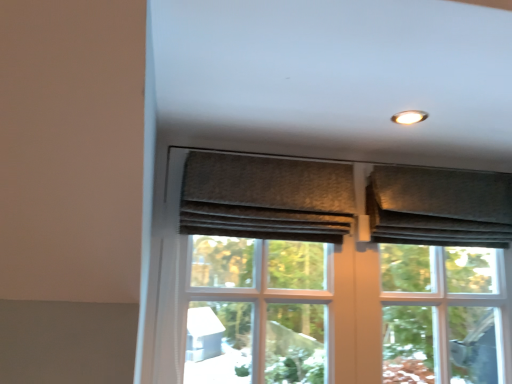
This screenshot has height=384, width=512. Describe the element at coordinates (439, 207) in the screenshot. I see `textured gray curtain at upper right, the 1th curtain when ordered from right to left` at that location.

This screenshot has height=384, width=512. Describe the element at coordinates (446, 314) in the screenshot. I see `textured gray fabric at upper right` at that location.

This screenshot has height=384, width=512. What do you see at coordinates (266, 198) in the screenshot? I see `textured gray curtain at upper center, which is the 1th curtain in left-to-right order` at bounding box center [266, 198].

This screenshot has width=512, height=384. Identify the location of textured gray curtain at upper right, the 2th curtain viewed from the left. (439, 207).

Considering the sizes of objects matte brown screen door at center and textured gray curtain at upper center, which ranks as the second curtain in right-to-left order, in the image provided, who is taller, matte brown screen door at center or textured gray curtain at upper center, which ranks as the second curtain in right-to-left order,?

matte brown screen door at center is taller.

From the image's perspective, is matte brown screen door at center above textured gray curtain at upper center, which ranks as the second curtain in right-to-left order?

No, from the image's perspective, matte brown screen door at center is not on top of textured gray curtain at upper center, which ranks as the second curtain in right-to-left order.

Would you say matte brown screen door at center is a long distance from textured gray curtain at upper center, which is the 1th curtain in left-to-right order?

Result: matte brown screen door at center is actually quite close to textured gray curtain at upper center, which is the 1th curtain in left-to-right order.

From a real-world perspective, which object rests below the other?

In real-world perspective, textured gray fabric at upper right is lower.

Which is closer to the camera, (480, 269) or (253, 175)?

Point (480, 269) is positioned farther from the camera compared to point (253, 175).

From the image's perspective, between textured gray fabric at upper right and textured gray curtain at upper center, which ranks as the second curtain in right-to-left order, who is located below?

textured gray fabric at upper right appears lower in the image.

Is textured gray fabric at upper right facing towards textured gray curtain at upper center, which ranks as the second curtain in right-to-left order?

No, textured gray fabric at upper right does not turn towards textured gray curtain at upper center, which ranks as the second curtain in right-to-left order.

Does textured gray fabric at upper right have a greater width compared to matte brown screen door at center?

Indeed, textured gray fabric at upper right has a greater width compared to matte brown screen door at center.

Image resolution: width=512 pixels, height=384 pixels. I want to click on bay window behind the matte brown screen door at center, so click(446, 314).

Considering the sizes of textured gray fabric at upper right and matte brown screen door at center in the image, is textured gray fabric at upper right bigger or smaller than matte brown screen door at center?

textured gray fabric at upper right is bigger than matte brown screen door at center.

Considering the points (250, 335) and (424, 310), which point is in front, point (250, 335) or point (424, 310)?

Point (424, 310)

In order to click on screen door below the textured gray fabric at upper right (from the image's perspective) in this screenshot , I will do `click(256, 311)`.

Looking at this image, from a real-world perspective, which is physically above, matte brown screen door at center or textured gray fabric at upper right?

textured gray fabric at upper right is physically above.

In terms of size, does matte brown screen door at center appear bigger or smaller than textured gray fabric at upper right?

In the image, matte brown screen door at center appears to be smaller than textured gray fabric at upper right.

Looking at this image, from the image's perspective, is textured gray curtain at upper center, which ranks as the second curtain in right-to-left order, on top of matte brown screen door at center?

Yes, from the image's perspective, textured gray curtain at upper center, which ranks as the second curtain in right-to-left order, is on top of matte brown screen door at center.

From the matte brown screen door at center, count 1st curtain to the right and point to it. Please provide its 2D coordinates.

[(266, 198)]

Is textured gray curtain at upper center, which ranks as the second curtain in right-to-left order, to the left or to the right of matte brown screen door at center in the image?

textured gray curtain at upper center, which ranks as the second curtain in right-to-left order, is to the right of matte brown screen door at center.

Which point is more forward, (295, 218) or (203, 261)?

The point (295, 218) is closer.

How distant is textured gray curtain at upper center, which is the 1th curtain in left-to-right order, from textured gray curtain at upper right, the 1th curtain when ordered from right to left?

textured gray curtain at upper center, which is the 1th curtain in left-to-right order, and textured gray curtain at upper right, the 1th curtain when ordered from right to left, are 12.53 inches apart.

Which object is positioned more to the left, textured gray curtain at upper center, which ranks as the second curtain in right-to-left order, or textured gray curtain at upper right, the 1th curtain when ordered from right to left?

Positioned to the left is textured gray curtain at upper center, which ranks as the second curtain in right-to-left order.

Which of these two, textured gray curtain at upper center, which ranks as the second curtain in right-to-left order, or textured gray curtain at upper right, the 2th curtain viewed from the left, is bigger?

textured gray curtain at upper right, the 2th curtain viewed from the left.

Is textured gray curtain at upper center, which is the 1th curtain in left-to-right order, turned away from textured gray curtain at upper right, the 1th curtain when ordered from right to left?

No, textured gray curtain at upper center, which is the 1th curtain in left-to-right order, is not facing away from textured gray curtain at upper right, the 1th curtain when ordered from right to left.

Is textured gray fabric at upper right wider than textured gray curtain at upper right, the 1th curtain when ordered from right to left?

In fact, textured gray fabric at upper right might be narrower than textured gray curtain at upper right, the 1th curtain when ordered from right to left.

Is point (408, 300) positioned after point (489, 184)?

No, it is in front of (489, 184).

From a real-world perspective, relative to textured gray curtain at upper right, the 2th curtain viewed from the left, is textured gray fabric at upper right vertically above or below?

textured gray fabric at upper right is below textured gray curtain at upper right, the 2th curtain viewed from the left.

Locate an element on the screen. The height and width of the screenshot is (384, 512). screen door behind the textured gray curtain at upper center, which is the 1th curtain in left-to-right order is located at coordinates (256, 311).

Locate an element on the screen. the 1st curtain above the textured gray fabric at upper right (from a real-world perspective) is located at coordinates (266, 198).

When comparing their distances from matte brown screen door at center, does textured gray curtain at upper right, the 1th curtain when ordered from right to left, or textured gray curtain at upper center, which ranks as the second curtain in right-to-left order, seem closer?

The object closer to matte brown screen door at center is textured gray curtain at upper center, which ranks as the second curtain in right-to-left order.

Based on their spatial positions, is textured gray curtain at upper center, which ranks as the second curtain in right-to-left order, or textured gray fabric at upper right closer to matte brown screen door at center?

Based on the image, textured gray curtain at upper center, which ranks as the second curtain in right-to-left order, appears to be nearer to matte brown screen door at center.

Based on their spatial positions, is textured gray curtain at upper right, the 1th curtain when ordered from right to left, or matte brown screen door at center closer to textured gray curtain at upper center, which ranks as the second curtain in right-to-left order?

matte brown screen door at center lies closer to textured gray curtain at upper center, which ranks as the second curtain in right-to-left order, than the other object.

From the image, which object appears to be nearer to textured gray curtain at upper center, which is the 1th curtain in left-to-right order, matte brown screen door at center or textured gray curtain at upper right, the 1th curtain when ordered from right to left?

The object closer to textured gray curtain at upper center, which is the 1th curtain in left-to-right order, is matte brown screen door at center.

From the image, which object appears to be nearer to textured gray fabric at upper right, matte brown screen door at center or textured gray curtain at upper right, the 1th curtain when ordered from right to left?

The object closer to textured gray fabric at upper right is textured gray curtain at upper right, the 1th curtain when ordered from right to left.

Based on their spatial positions, is textured gray curtain at upper right, the 2th curtain viewed from the left, or textured gray fabric at upper right further from textured gray curtain at upper center, which is the 1th curtain in left-to-right order?

Based on the image, textured gray fabric at upper right appears to be further to textured gray curtain at upper center, which is the 1th curtain in left-to-right order.

From the picture: From the image, which object appears to be nearer to textured gray curtain at upper right, the 2th curtain viewed from the left, textured gray fabric at upper right or matte brown screen door at center?

textured gray fabric at upper right.

Based on their spatial positions, is textured gray curtain at upper center, which is the 1th curtain in left-to-right order, or textured gray curtain at upper right, the 1th curtain when ordered from right to left, further from matte brown screen door at center?

Based on the image, textured gray curtain at upper right, the 1th curtain when ordered from right to left, appears to be further to matte brown screen door at center.

Where is `bay window between textured gray curtain at upper center, which is the 1th curtain in left-to-right order, and textured gray curtain at upper right, the 1th curtain when ordered from right to left`? The width and height of the screenshot is (512, 384). bay window between textured gray curtain at upper center, which is the 1th curtain in left-to-right order, and textured gray curtain at upper right, the 1th curtain when ordered from right to left is located at coordinates (446, 314).

Where is `curtain between matte brown screen door at center and textured gray fabric at upper right from left to right`? The image size is (512, 384). curtain between matte brown screen door at center and textured gray fabric at upper right from left to right is located at coordinates (266, 198).

The image size is (512, 384). I want to click on curtain between matte brown screen door at center and textured gray curtain at upper right, the 2th curtain viewed from the left, from left to right, so (x=266, y=198).

Where is `bay window located between matte brown screen door at center and textured gray curtain at upper right, the 1th curtain when ordered from right to left, in the left-right direction`? bay window located between matte brown screen door at center and textured gray curtain at upper right, the 1th curtain when ordered from right to left, in the left-right direction is located at coordinates (446, 314).